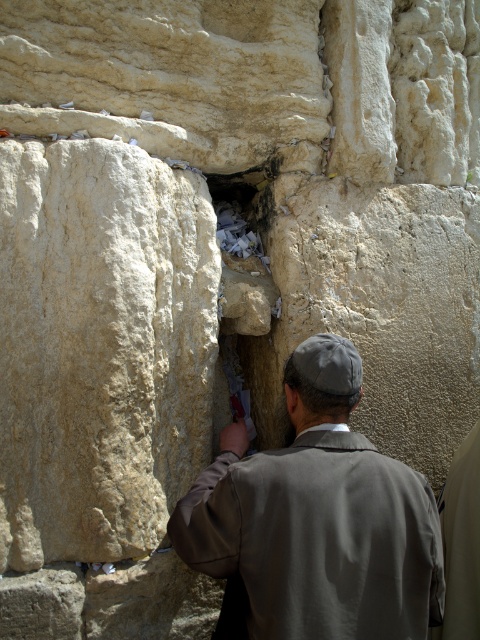
Does gray fabric jacket at center appear under white paper at center?

Yes.

Between point (190, 516) and point (273, 310), which one is positioned in front?

Point (190, 516) is in front.

Locate an element on the screen. gray fabric jacket at center is located at coordinates (317, 516).